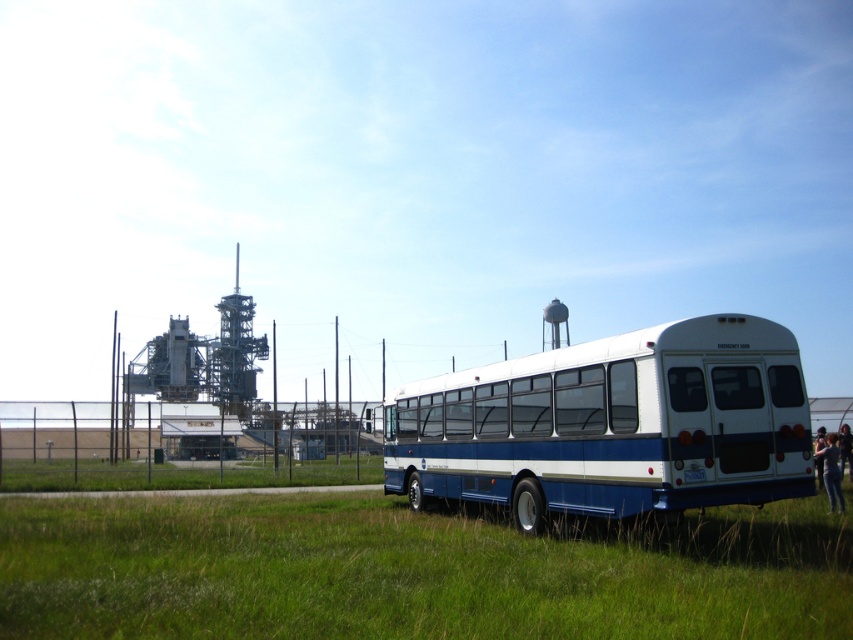
You are standing at the point marked by the coordinates point (413, 572). Based on the scene description, what is the terrain like at your current location?

The point (413, 572) indicates green grass at lower center, so the terrain at your current location is green grass.

You are standing in the middle of the green grass at lower center and want to reach the white matte bus at right. Which direction should you walk to get there?

You should walk to the right because the green grass at lower center is positioned on the left side of the white matte bus at right, meaning the bus is to your right.